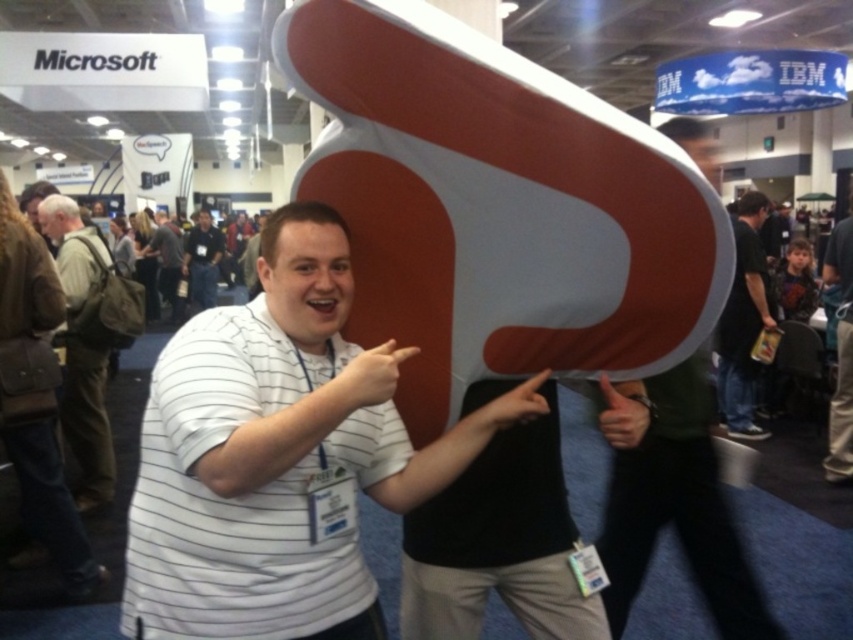
What is the color of the backpack located at the coordinates point (88,422)?

The brown canvas backpack at left is located at point (88,422).

You are standing in the expo hall and see the brown canvas backpack at left. If you want to reach it without moving your feet, can you do so?

The brown canvas backpack at left is 8.78 feet from viewer, so you cannot reach it without moving your feet since it is too far away.

In the scene shown: You are at the tech expo and see two points marked in the image. The first point is at coordinates point (47, 230) and the second is at point (839, 381). Which point is closer to you?

Point (47, 230) is in front of point (839, 381), so it is closer to you.